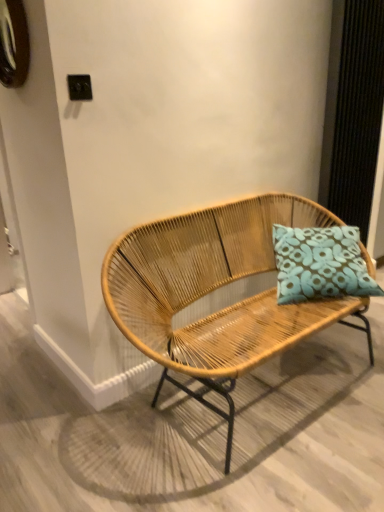
Question: Would you say teal fabric pillow at center is a long distance from brushed metal clock at upper left?

Choices:
 (A) no
 (B) yes

Answer: (B)

Question: From the image's perspective, is teal fabric pillow at center below brushed metal clock at upper left?

Choices:
 (A) no
 (B) yes

Answer: (B)

Question: From a real-world perspective, does teal fabric pillow at center sit lower than brushed metal clock at upper left?

Choices:
 (A) no
 (B) yes

Answer: (B)

Question: Considering the relative sizes of teal fabric pillow at center and brushed metal clock at upper left in the image provided, is teal fabric pillow at center smaller than brushed metal clock at upper left?

Choices:
 (A) yes
 (B) no

Answer: (B)

Question: Could brushed metal clock at upper left be considered to be inside teal fabric pillow at center?

Choices:
 (A) yes
 (B) no

Answer: (B)

Question: Is teal fabric pillow at center facing away from brushed metal clock at upper left?

Choices:
 (A) no
 (B) yes

Answer: (A)

Question: Is the surface of natural wood bench at center in direct contact with teal fabric pillow at center?

Choices:
 (A) no
 (B) yes

Answer: (A)

Question: Is natural wood bench at center looking in the opposite direction of teal fabric pillow at center?

Choices:
 (A) yes
 (B) no

Answer: (A)

Question: Can you confirm if natural wood bench at center is thinner than teal fabric pillow at center?

Choices:
 (A) yes
 (B) no

Answer: (B)

Question: Could you tell me if natural wood bench at center is turned towards teal fabric pillow at center?

Choices:
 (A) yes
 (B) no

Answer: (A)

Question: Does natural wood bench at center have a larger size compared to teal fabric pillow at center?

Choices:
 (A) yes
 (B) no

Answer: (A)

Question: Can you confirm if natural wood bench at center is shorter than teal fabric pillow at center?

Choices:
 (A) no
 (B) yes

Answer: (A)

Question: Is brushed metal clock at upper left taller than natural wood bench at center?

Choices:
 (A) yes
 (B) no

Answer: (B)